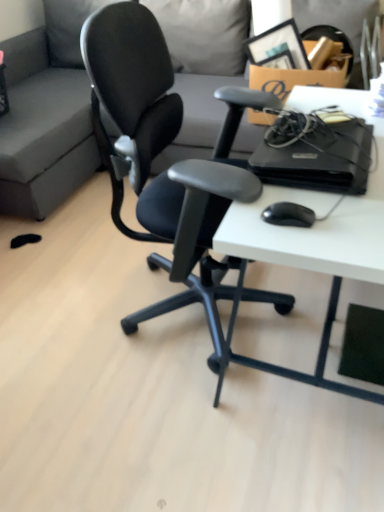
This screenshot has height=512, width=384. Find the location of `free point below white matte desk at center (from a real-world perspective)`. free point below white matte desk at center (from a real-world perspective) is located at coordinates (302, 349).